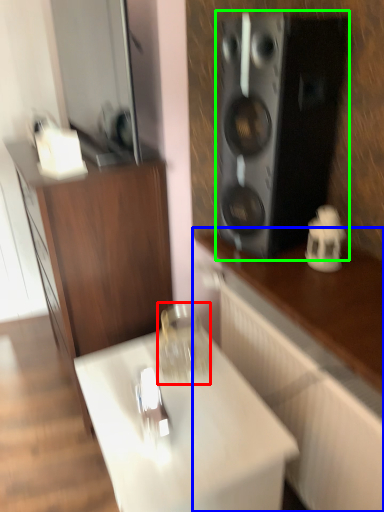
Question: Which is nearer to the glass jar (highlighted by a red box)? cabinetry (highlighted by a blue box) or speaker (highlighted by a green box).

Choices:
 (A) cabinetry
 (B) speaker

Answer: (A)